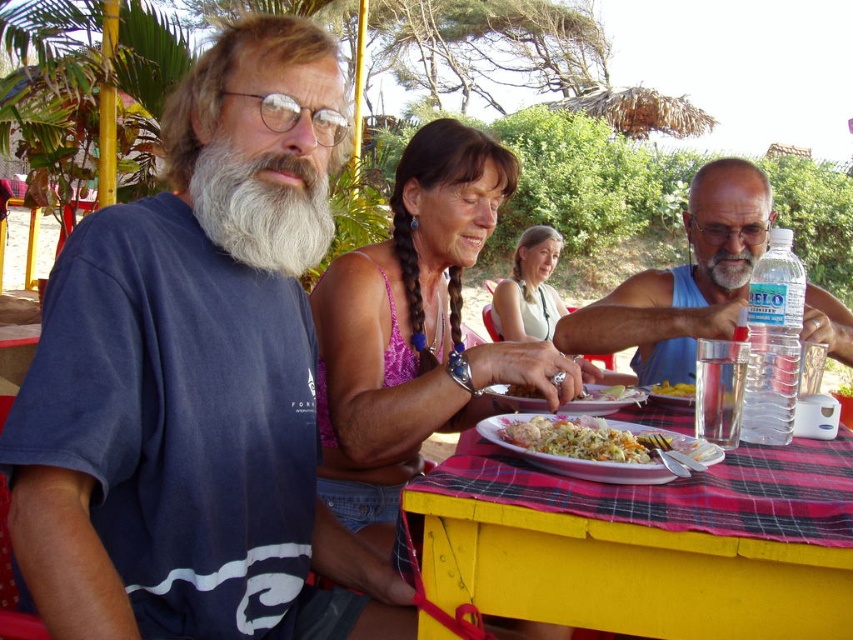
Question: Which object is the closest to the white rice at center?

Choices:
 (A) white matte beard at left
 (B) yellow matte pasta at center
 (C) matte pink tank top at center

Answer: (A)

Question: Which point appears closest to the camera in this image?

Choices:
 (A) (680, 385)
 (B) (657, 380)
 (C) (515, 451)

Answer: (C)

Question: Is the position of blue cotton t-shirt at center more distant than that of white matte beard at left?

Choices:
 (A) no
 (B) yes

Answer: (A)

Question: Can you confirm if white rice at center is wider than yellow matte pasta at center?

Choices:
 (A) no
 (B) yes

Answer: (B)

Question: Which point is farther to the camera?

Choices:
 (A) (750, 264)
 (B) (296, 275)

Answer: (A)

Question: Is yellow plastic table at center closer to camera compared to white rice at center?

Choices:
 (A) yes
 (B) no

Answer: (A)